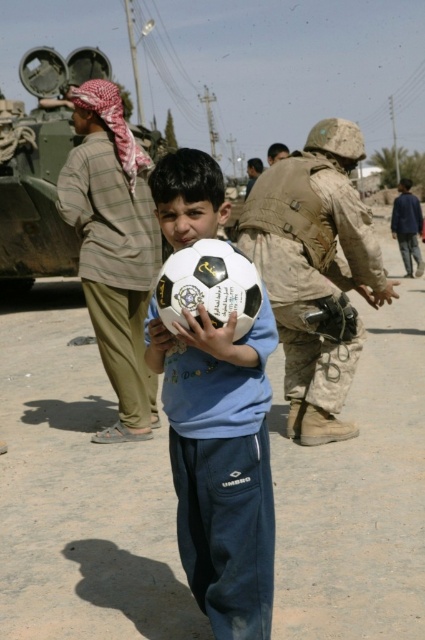
You are a photographer trying to capture the blue fabric jacket at upper right and the camouflage fabric helmet at center in the same frame. Which object should you focus on first to ensure both are in the frame?

The blue fabric jacket at upper right is smaller than the camouflage fabric helmet at center, so you should focus on the camouflage fabric helmet at center first to ensure both are in the frame since it is larger and easier to locate.

Looking at this image, you are a photographer trying to capture the blue fabric jacket at upper right in your shot. Based on the scene description, where should you position your camera relative to the young boy holding the soccer ball?

The blue fabric jacket at upper right is located at point (408, 227), so you should position your camera to the upper right relative to the young boy holding the soccer ball to capture it in the shot.

You are a photographer trying to capture a photo of the blue fabric jacket at upper right and the camouflage fabric helmet at center. Which object should you adjust your camera to focus on first if you want to capture both in the same frame without moving the camera?

You should focus on the camouflage fabric helmet at center first because the blue fabric jacket at upper right is to the right of it, so adjusting the focus starting from the center will help include both in the frame.